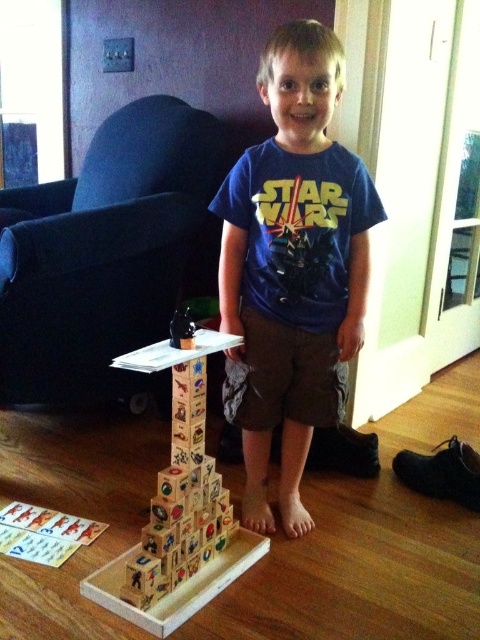
The boy is trying to place a toy on top of the wooden blocks at center. He has a blue cotton shirt at center nearby. Can he place the toy on the shirt first and then onto the blocks without it falling over?

The blue cotton shirt at center is taller than wooden blocks at center, so placing the toy on the shirt first would not be stable since the shirt is higher up and might cause the toy to fall when moving it to the blocks.

The boy is trying to place a new block on the wooden blocks at center. He wants to know which direction he should move his hand to reach the blue cotton shirt at center first before placing the block. Which direction should he move his hand?

The blue cotton shirt at center is positioned on the right side of wooden blocks at center, so the boy should move his hand to the right to reach the blue cotton shirt at center first before placing the block.

The boy is wearing a blue cotton shirt at center and has wooden blocks at center nearby. Which item takes up more horizontal space?

The blue cotton shirt at center has a larger width than the wooden blocks at center, so the blue cotton shirt at center takes up more horizontal space.